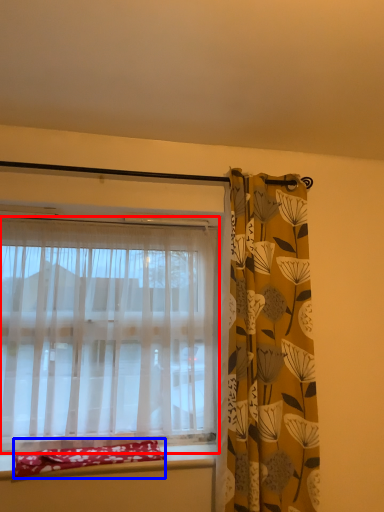
Question: Among these objects, which one is nearest to the camera, curtain (highlighted by a red box) or material (highlighted by a blue box)?

Choices:
 (A) curtain
 (B) material

Answer: (B)